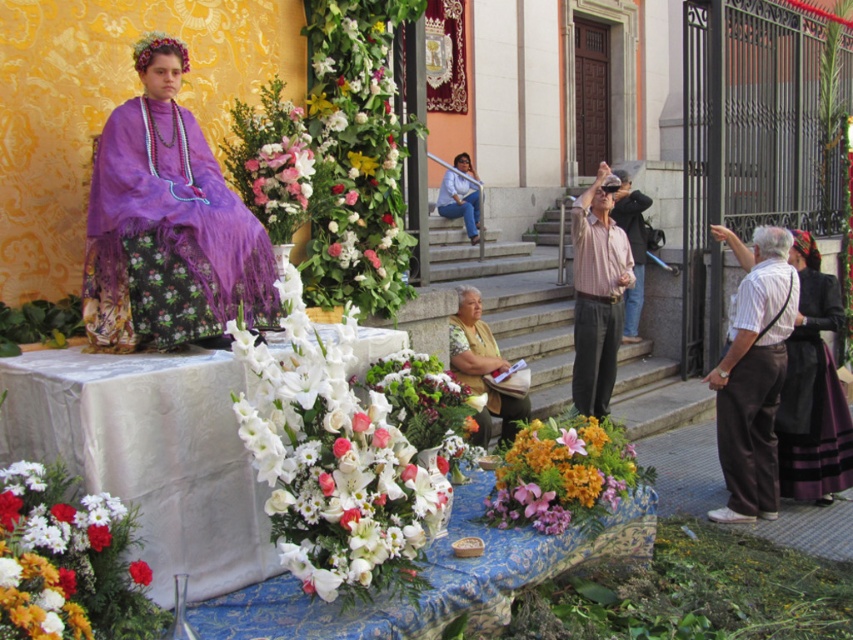
Question: Considering the real-world distances, which object is closest to the brown cotton pants at right?

Choices:
 (A) pink silk flowers at center
 (B) blue denim jeans at center
 (C) purple silky dress at left

Answer: (A)

Question: Which point appears closest to the camera in this image?

Choices:
 (A) (322, 508)
 (B) (640, 195)

Answer: (A)

Question: Is matte pink shirt at upper right thinner than white matte flower at center?

Choices:
 (A) no
 (B) yes

Answer: (A)

Question: Is the position of brown cotton pants at right less distant than that of pink silk flowers at center?

Choices:
 (A) yes
 (B) no

Answer: (B)

Question: Which object is closer to the camera taking this photo?

Choices:
 (A) white matte flowers at lower left
 (B) purple silky dress at left

Answer: (A)

Question: Where is floral-patterned fabric table at center located in relation to matte pink shirt at upper right in the image?

Choices:
 (A) left
 (B) right

Answer: (A)